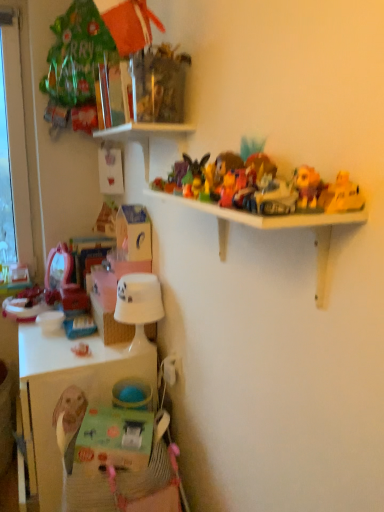
Where is `vacant space situated on the left part of white glossy lampshade at lower center`? vacant space situated on the left part of white glossy lampshade at lower center is located at coordinates (87, 355).